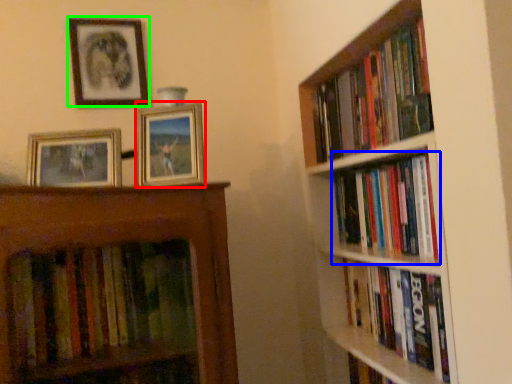
Question: Which is nearer to the picture frame (highlighted by a red box)? book (highlighted by a blue box) or picture frame (highlighted by a green box).

Choices:
 (A) book
 (B) picture frame

Answer: (B)